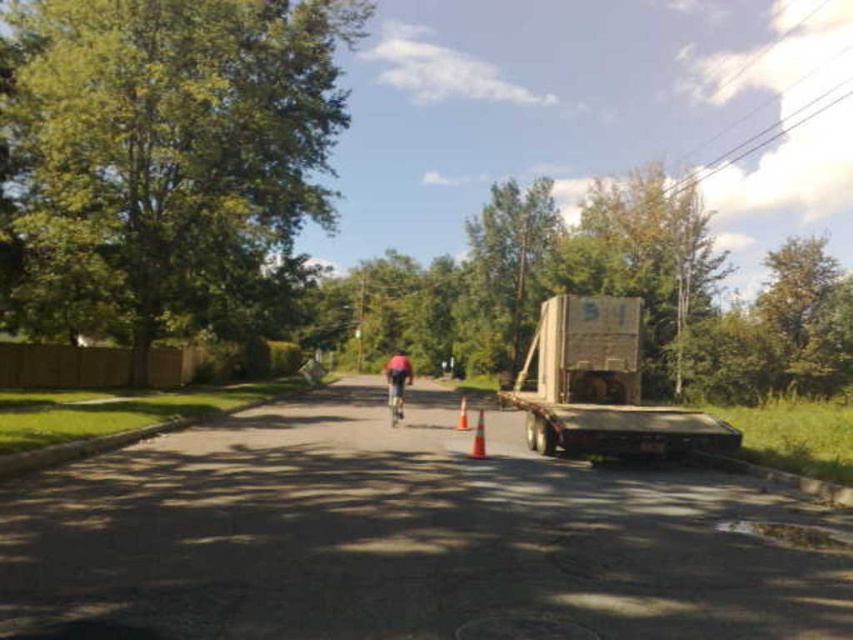
Between point (608, 428) and point (466, 417), which one is positioned in front?

Point (608, 428) is in front.

Can you confirm if wooden crate at right is positioned to the left of orange cone at center?

A: In fact, wooden crate at right is to the right of orange cone at center.

Between point (550, 378) and point (461, 413), which one is positioned in front?

Positioned in front is point (550, 378).

At what (x,y) coordinates should I click in order to perform the action: click on wooden crate at right. Please return your answer as a coordinate pair (x, y). Looking at the image, I should click on (601, 387).

Does shiny metallic bicycle at center come in front of orange matte traffic cone at center?

No, shiny metallic bicycle at center is further to the viewer.

Is shiny metallic bicycle at center bigger than orange matte traffic cone at center?

Indeed, shiny metallic bicycle at center has a larger size compared to orange matte traffic cone at center.

This screenshot has width=853, height=640. Describe the element at coordinates (396, 394) in the screenshot. I see `shiny metallic bicycle at center` at that location.

Locate an element on the screen. This screenshot has width=853, height=640. shiny metallic bicycle at center is located at coordinates (396, 394).

The image size is (853, 640). Describe the element at coordinates (396, 394) in the screenshot. I see `shiny metallic bicycle at center` at that location.

Consider the image. Is shiny metallic bicycle at center to the right of orange cone at center from the viewer's perspective?

Incorrect, shiny metallic bicycle at center is not on the right side of orange cone at center.

Identify the location of shiny metallic bicycle at center. (396, 394).

Identify the location of shiny metallic bicycle at center. click(396, 394).